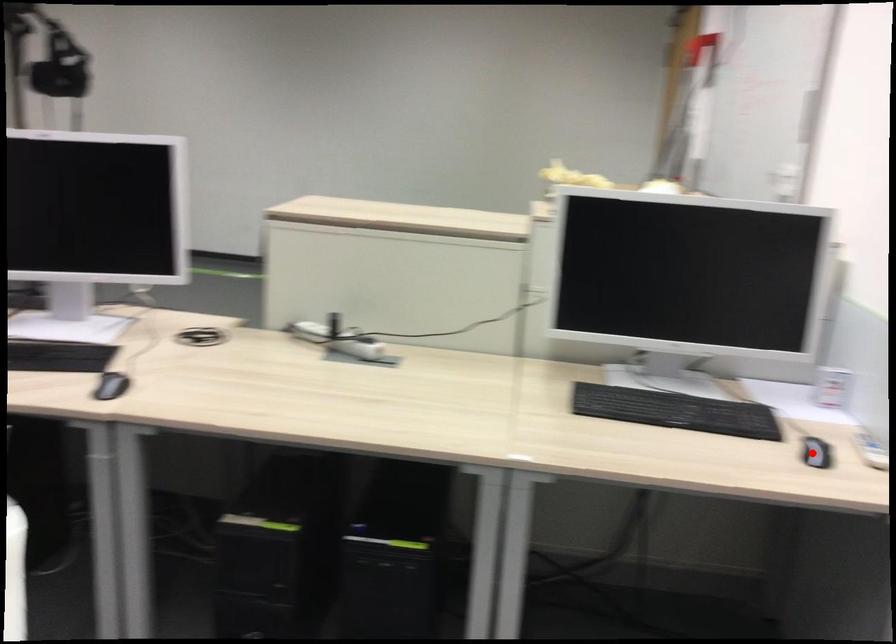
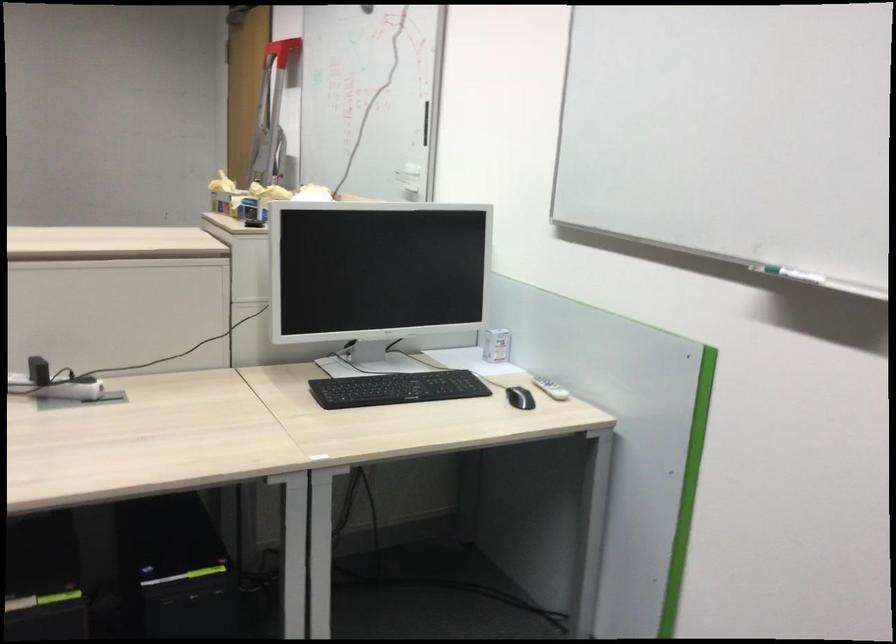
Locate, in the second image, the point that corresponds to the highlighted location in the first image.

(520, 398)